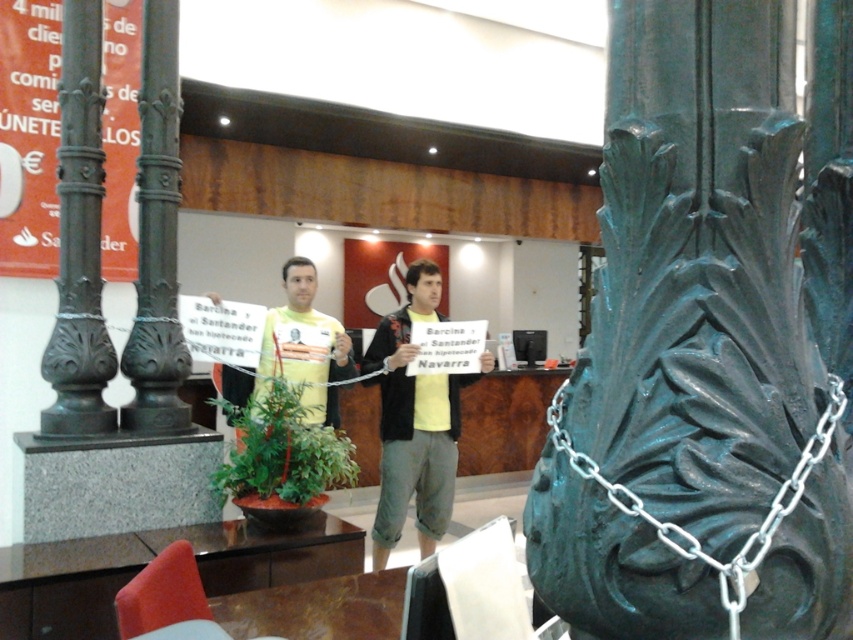
Question: Is green patinated metal column at center to the right of yellow matte shirt at center from the viewer's perspective?

Choices:
 (A) yes
 (B) no

Answer: (A)

Question: Which object appears farthest from the camera in this image?

Choices:
 (A) green patinated metal column at center
 (B) yellow matte shirt at center
 (C) dark green metal pillar at left
 (D) bronze textured column at left

Answer: (B)

Question: Does bronze textured column at left appear under yellow matte shirt at center?

Choices:
 (A) no
 (B) yes

Answer: (A)

Question: Among these points, which one is farthest from the camera?

Choices:
 (A) (152, 413)
 (B) (432, 291)

Answer: (B)

Question: Which point is closer to the camera?

Choices:
 (A) bronze textured column at left
 (B) yellow matte shirt at center
 (C) green patinated metal column at center
 (D) dark green metal pillar at left

Answer: (C)

Question: Can you confirm if green patinated metal column at center is smaller than dark green metal pillar at left?

Choices:
 (A) no
 (B) yes

Answer: (A)